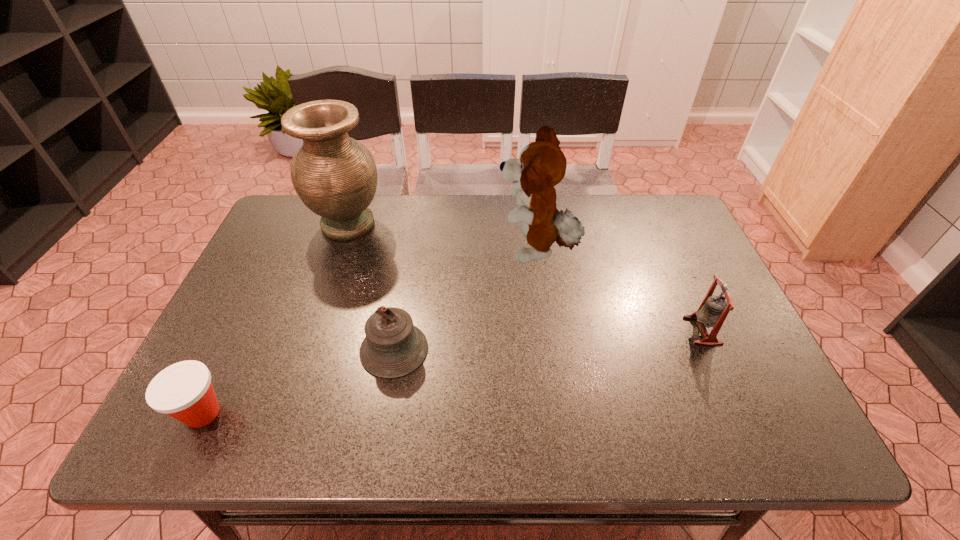
Find the location of a particular element. The width and height of the screenshot is (960, 540). vase is located at coordinates (335, 176).

You are a GUI agent. You are given a task and a screenshot of the screen. Output one action in this format:
    pyautogui.click(x=<x>, y=<y>)
    Task: Click on the fourth object from left to right
    This screenshot has height=540, width=960.
    Given the screenshot: What is the action you would take?
    pyautogui.click(x=542, y=165)

Identify the location of the rightmost object. (713, 310).

Locate an element on the screen. The height and width of the screenshot is (540, 960). the left bell is located at coordinates (393, 347).

The width and height of the screenshot is (960, 540). In order to click on Dixie cup in this screenshot , I will do `click(184, 391)`.

Find the location of `the nearest object`. the nearest object is located at coordinates (184, 391).

You are a GUI agent. You are given a task and a screenshot of the screen. Output one action in this format:
    pyautogui.click(x=<x>, y=<y>)
    Task: Click on the free spot located 0.060m on the right of the vase
    The height and width of the screenshot is (540, 960).
    Given the screenshot: What is the action you would take?
    pyautogui.click(x=405, y=224)

What are the coordinates of `vacant space situated 0.330m on the face of the puppy` in the screenshot? It's located at (385, 252).

This screenshot has width=960, height=540. I want to click on free region located on the face of the puppy, so click(x=469, y=252).

Find the location of a particular element. free space located 0.330m on the face of the puppy is located at coordinates (385, 252).